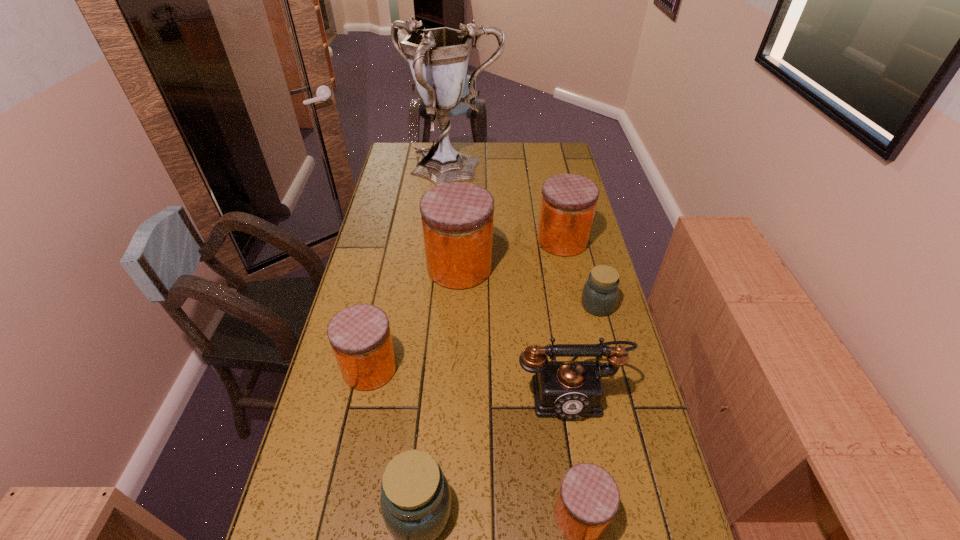
I want to click on free spot between the second tallest object and the second biggest orange jar, so click(511, 254).

Image resolution: width=960 pixels, height=540 pixels. Find the location of `object that can be found as the sixth closest to the farthest object`. object that can be found as the sixth closest to the farthest object is located at coordinates (416, 503).

What are the coordinates of `the closest object to the telephone` in the screenshot? It's located at (588, 499).

Find the location of a particular element. Image resolution: width=960 pixels, height=540 pixels. the third closest jar relative to the second tallest jar is located at coordinates (360, 336).

Locate an element on the screen. The height and width of the screenshot is (540, 960). jar that can be found as the fifth closest to the farther green jar is located at coordinates 416,503.

Locate an element on the screen. This screenshot has width=960, height=540. orange jar object that ranks as the third closest to the second tallest jar is located at coordinates (588, 499).

Choose which orange jar is the nearest neighbor to the telephone. Please provide its 2D coordinates. Your answer should be formatted as a tuple, i.e. [(x, y)], where the tuple contains the x and y coordinates of a point satisfying the conditions above.

[(588, 499)]

You are a GUI agent. You are given a task and a screenshot of the screen. Output one action in this format:
    pyautogui.click(x=<x>, y=<y>)
    Task: Click on the free spot that satisfies the following two spatial constraints: 1. on the back side of the third biggest orange jar; 2. on the right side of the biggest orange jar
    The width and height of the screenshot is (960, 540).
    Given the screenshot: What is the action you would take?
    pyautogui.click(x=392, y=267)

Where is `free space that satisfies the following two spatial constraints: 1. on the front side of the farthest object; 2. on the left side of the second tallest jar`? The height and width of the screenshot is (540, 960). free space that satisfies the following two spatial constraints: 1. on the front side of the farthest object; 2. on the left side of the second tallest jar is located at coordinates (444, 240).